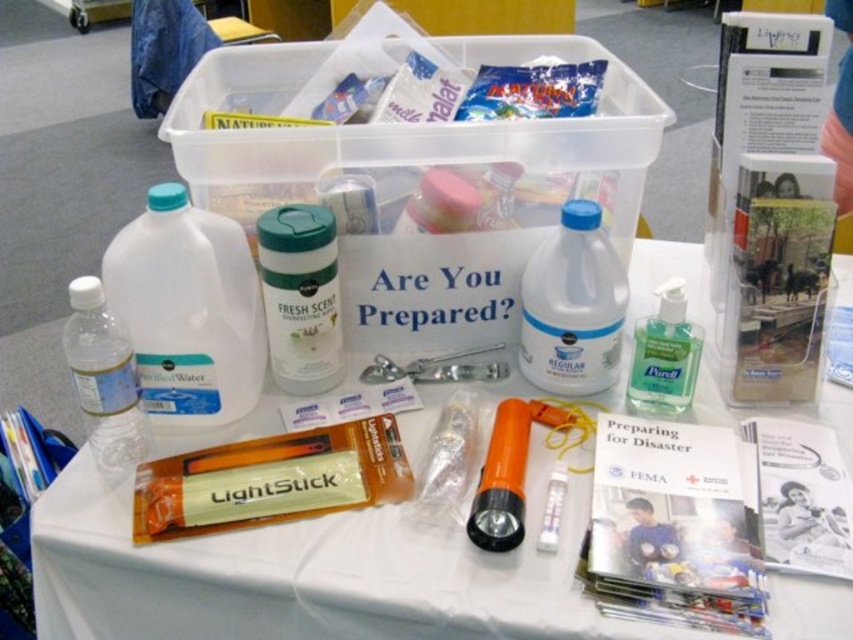
Question: Among these objects, which one is nearest to the camera?

Choices:
 (A) white plastic bottle at center
 (B) clear plastic bottle at lower left
 (C) green translucent plastic hand sanitizer at center right

Answer: (B)

Question: Considering the relative positions of clear plastic bottle at center and white matte container at center in the image provided, where is clear plastic bottle at center located with respect to white matte container at center?

Choices:
 (A) right
 (B) left

Answer: (A)

Question: Estimate the real-world distances between objects in this image. Which object is closer to the white matte container at center?

Choices:
 (A) orange plastic lightstick at center
 (B) white plastic bottle at center

Answer: (A)

Question: Can you confirm if orange plastic lightstick at center is bigger than clear plastic bottle at lower left?

Choices:
 (A) yes
 (B) no

Answer: (A)

Question: Among these points, which one is nearest to the camera?

Choices:
 (A) (334, 356)
 (B) (109, 314)
 (C) (585, 364)
 (D) (670, 301)

Answer: (B)

Question: Is white matte container at center below clear plastic bottle at lower left?

Choices:
 (A) no
 (B) yes

Answer: (A)